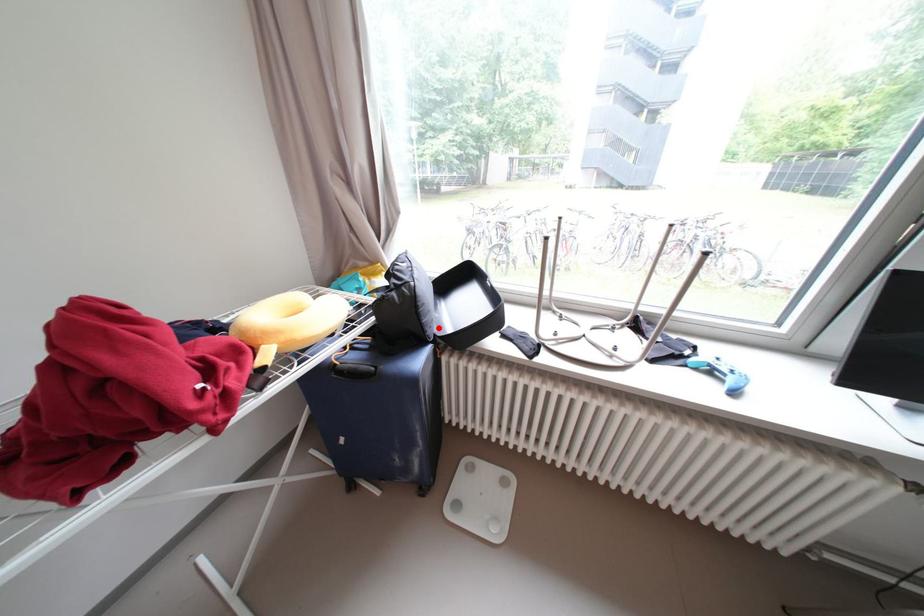
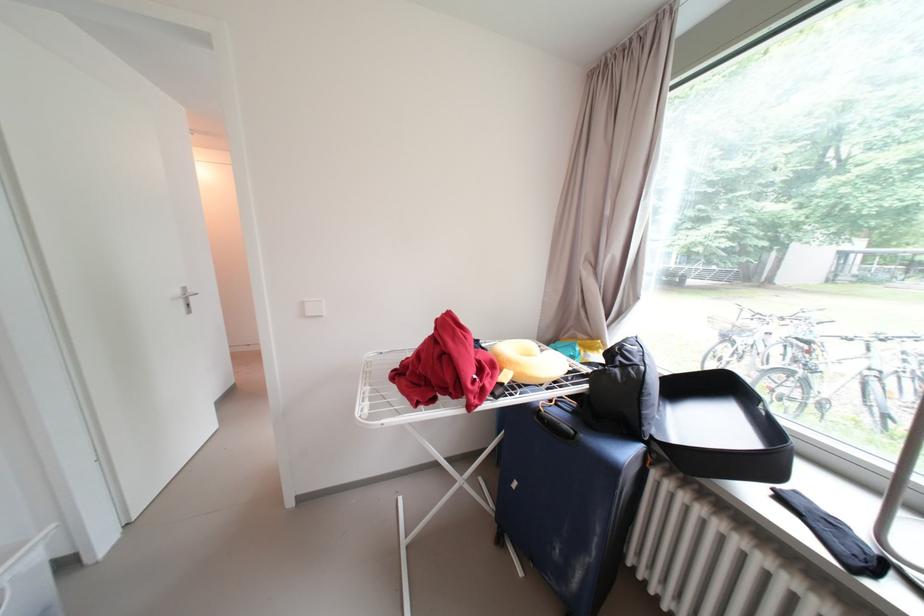
Question: I am providing you with two images of the same scene from different viewpoints. In image1, a red point is highlighted. Considering the same 3D point in image2, which of the following is correct?

Choices:
 (A) It is closer
 (B) It is farther

Answer: (B)